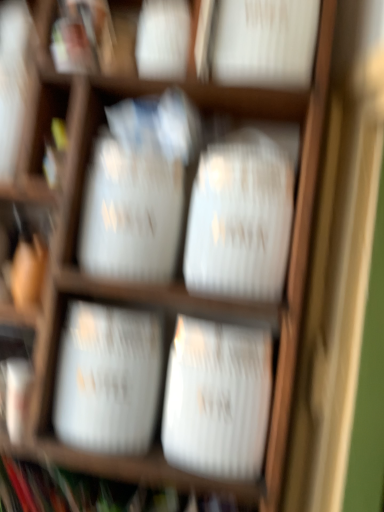
Question: Is white glossy vase at center, acting as the first wide starting from the bottom, facing away from white glossy vase at center, which is the 2th wide from bottom to top?

Choices:
 (A) yes
 (B) no

Answer: (B)

Question: Is the depth of white glossy vase at center, acting as the first wide starting from the bottom, greater than that of white glossy vase at center, which is the 2th wide from bottom to top?

Choices:
 (A) no
 (B) yes

Answer: (A)

Question: Is there a large distance between white glossy vase at center, acting as the first wide starting from the bottom, and white glossy vase at center, which is the 2th wide from bottom to top?

Choices:
 (A) no
 (B) yes

Answer: (A)

Question: From a real-world perspective, does white glossy vase at center, acting as the first wide starting from the bottom, sit lower than white glossy vase at center, which ranks as the second wide in top-to-bottom order?

Choices:
 (A) yes
 (B) no

Answer: (B)

Question: From the image's perspective, does white glossy vase at center, which is the 3th wide in top-to-bottom order, appear higher than white glossy vase at center, which is the 2th wide from bottom to top?

Choices:
 (A) no
 (B) yes

Answer: (A)

Question: Is the surface of white glossy vase at center, acting as the first wide starting from the bottom, in direct contact with white glossy vase at center, which ranks as the second wide in top-to-bottom order?

Choices:
 (A) no
 (B) yes

Answer: (B)

Question: Is white paper bag at center, the third wide from the bottom, shorter than white glossy vase at center, which is the 2th wide from bottom to top?

Choices:
 (A) yes
 (B) no

Answer: (B)

Question: Is white paper bag at center, which ranks as the 1th wide in top-to-bottom order, taller than white glossy vase at center, which is the 2th wide from bottom to top?

Choices:
 (A) yes
 (B) no

Answer: (A)

Question: From a real-world perspective, is white paper bag at center, which ranks as the 1th wide in top-to-bottom order, positioned over white glossy vase at center, which is the 2th wide from bottom to top, based on gravity?

Choices:
 (A) yes
 (B) no

Answer: (A)

Question: Considering the relative sizes of white paper bag at center, which ranks as the 1th wide in top-to-bottom order, and white glossy vase at center, which ranks as the second wide in top-to-bottom order, in the image provided, is white paper bag at center, which ranks as the 1th wide in top-to-bottom order, wider than white glossy vase at center, which ranks as the second wide in top-to-bottom order,?

Choices:
 (A) yes
 (B) no

Answer: (A)

Question: From the image's perspective, is white paper bag at center, which ranks as the 1th wide in top-to-bottom order, below white glossy vase at center, which is the 2th wide from bottom to top?

Choices:
 (A) no
 (B) yes

Answer: (A)

Question: Does white paper bag at center, the third wide from the bottom, appear on the left side of white glossy vase at center, which ranks as the second wide in top-to-bottom order?

Choices:
 (A) no
 (B) yes

Answer: (A)

Question: Does white glossy vase at center, which is the 3th wide in top-to-bottom order, have a lesser width compared to white paper bag at center, which ranks as the 1th wide in top-to-bottom order?

Choices:
 (A) yes
 (B) no

Answer: (A)